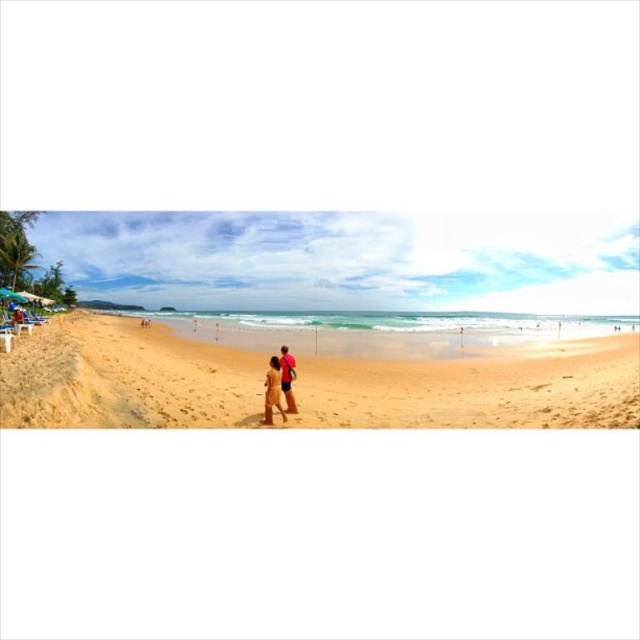
You are standing on the beach and see the golden sand beach at center and the tan skin couple at center. Which object is located to the right of the other?

The golden sand beach at center is located to the right of the tan skin couple at center.

You are standing at the beach and want to reach the point marked as point (72, 397). Considering you walk at a speed of 3 feet per second, how many seconds will it take you to reach that point?

The point (72, 397) is 576.56 feet away from the viewer. At a walking speed of 3 feet per second, it will take approximately 192.19 seconds to reach that point.

What are the coordinates of the golden sand beach at center?

The golden sand beach at center is located at coordinates point (476, 388).